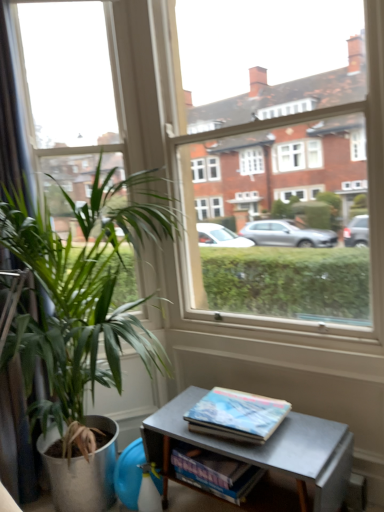
This screenshot has height=512, width=384. In order to click on vacant area that lies to the right of hardcover book at lower right in this screenshot , I will do `click(309, 432)`.